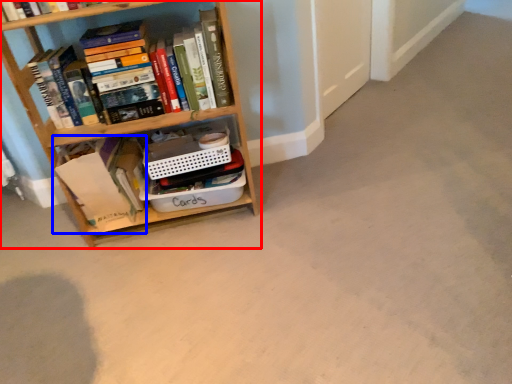
Question: Which point is further to the camera, bookcase (highlighted by a red box) or book (highlighted by a blue box)?

Choices:
 (A) bookcase
 (B) book

Answer: (B)